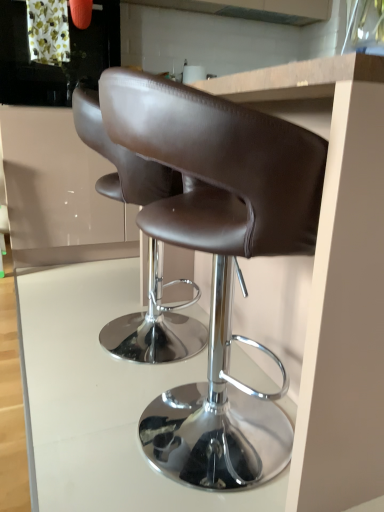
Find the location of a particular element. The image size is (384, 512). vacant location below brown leather stool at center, which is counted as the 1th chair, starting from the front (from a real-world perspective) is located at coordinates (170, 456).